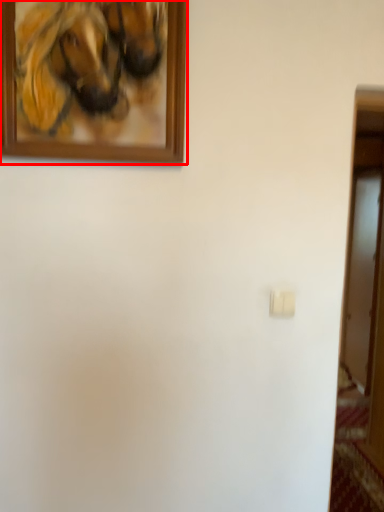
Question: Considering the relative positions of picture frame (annotated by the red box) and light switch in the image provided, where is picture frame (annotated by the red box) located with respect to the staircase?

Choices:
 (A) left
 (B) right

Answer: (A)